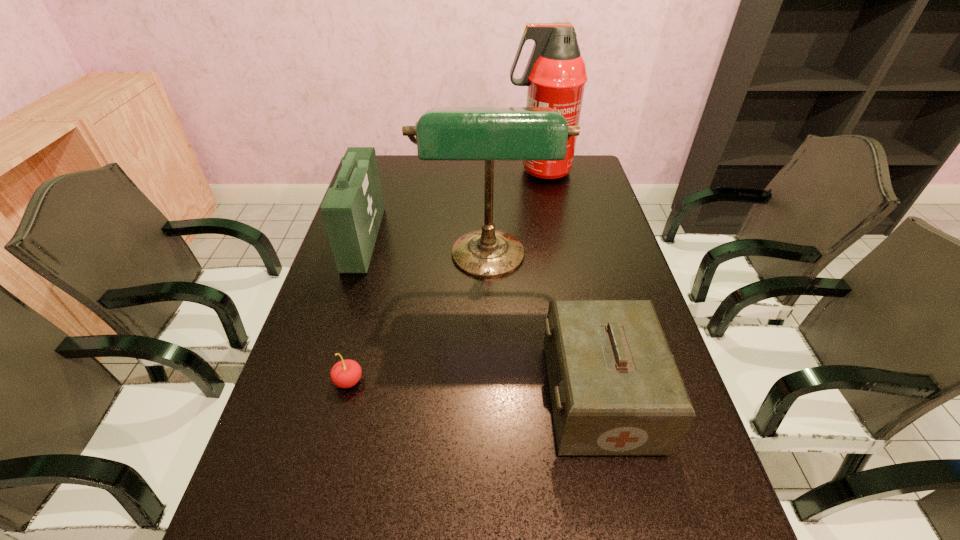
In the image, there is a desktop. Identify the location of free space at the left edge. Image resolution: width=960 pixels, height=540 pixels. (293, 508).

Locate an element on the screen. This screenshot has width=960, height=540. vacant space at the right edge of the desktop is located at coordinates (571, 215).

In the image, there is a desktop. At what (x,y) coordinates should I click in order to perform the action: click on vacant space at the far left corner. Please return your answer as a coordinate pair (x, y). The width and height of the screenshot is (960, 540). Looking at the image, I should click on (401, 168).

In order to click on vacant space at the far right corner of the desktop in this screenshot , I will do (x=582, y=162).

This screenshot has height=540, width=960. Find the location of `free spot between the taller first-aid kit and the right first-aid kit`. free spot between the taller first-aid kit and the right first-aid kit is located at coordinates (482, 318).

Find the location of a particular element. The height and width of the screenshot is (540, 960). empty space that is in between the taller first-aid kit and the cherry is located at coordinates (356, 310).

Identify the location of free space between the fourth tallest object and the cherry. The width and height of the screenshot is (960, 540). (474, 389).

Find the location of a particular element. The image size is (960, 540). vacant space in between the left first-aid kit and the table lamp is located at coordinates (426, 250).

Where is `vacant area that lies between the cherry and the third shortest object`? The image size is (960, 540). vacant area that lies between the cherry and the third shortest object is located at coordinates (356, 310).

Where is `empty space between the right first-aid kit and the third shortest object`? This screenshot has height=540, width=960. empty space between the right first-aid kit and the third shortest object is located at coordinates (482, 318).